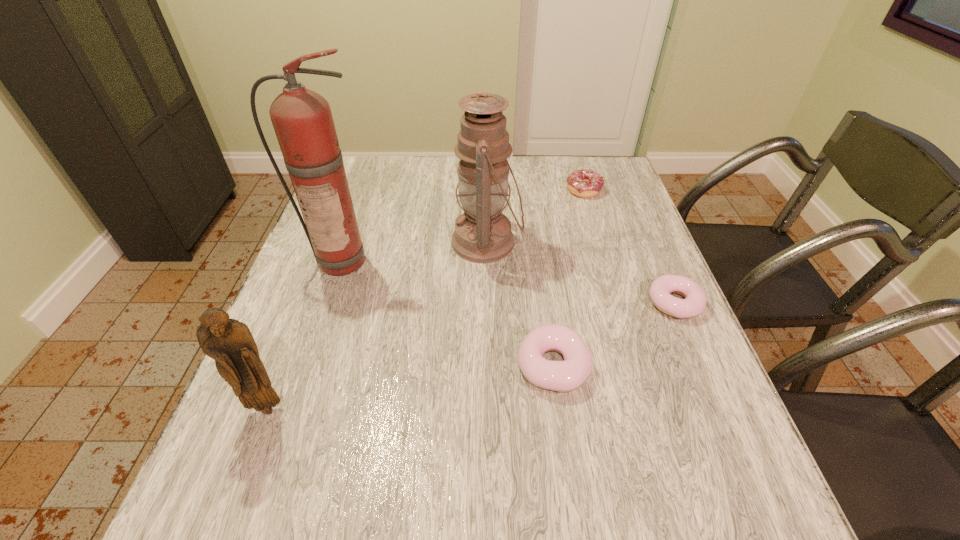
Locate an element on the screen. the nearest doughnut is located at coordinates (563, 376).

The width and height of the screenshot is (960, 540). I want to click on the rightmost doughnut, so click(661, 288).

Where is `the fourth farthest object`? Image resolution: width=960 pixels, height=540 pixels. the fourth farthest object is located at coordinates (661, 288).

Find the location of a particular element. This screenshot has height=540, width=960. the farthest object is located at coordinates (586, 183).

The image size is (960, 540). Find the location of `the second doughnut from left to right`. the second doughnut from left to right is located at coordinates (586, 183).

Where is `the fifth shortest object`? This screenshot has width=960, height=540. the fifth shortest object is located at coordinates (482, 234).

The width and height of the screenshot is (960, 540). I want to click on the third tallest object, so click(x=229, y=342).

Where is `the tallest object`? the tallest object is located at coordinates (302, 119).

This screenshot has width=960, height=540. I want to click on free space located on the left of the leftmost doughnut, so click(x=492, y=365).

Where is `free space located 0.110m on the back of the rightmost object`? Image resolution: width=960 pixels, height=540 pixels. free space located 0.110m on the back of the rightmost object is located at coordinates (654, 254).